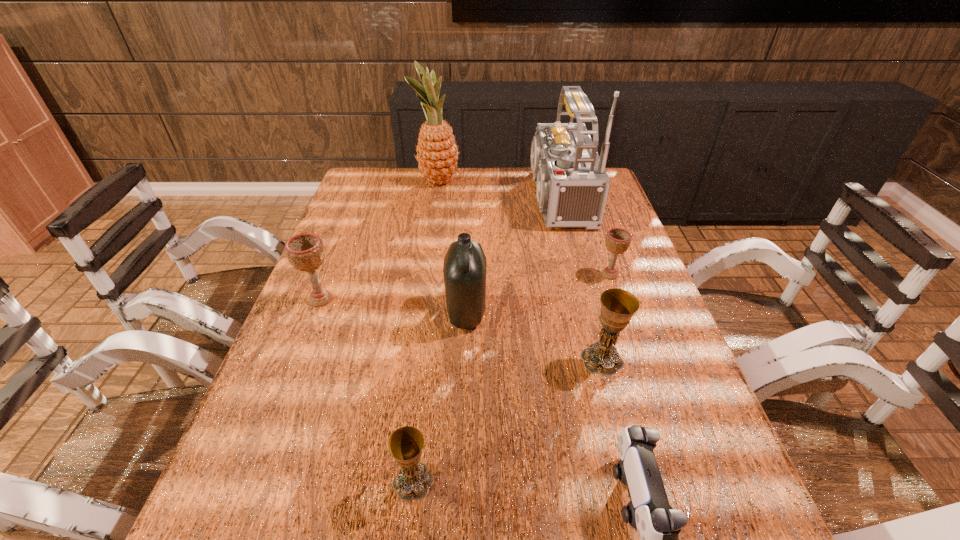
The height and width of the screenshot is (540, 960). In order to click on unoccupied position between the gray radio receiver and the pineapple in this screenshot , I will do `click(494, 189)`.

Find the location of `free space between the nearer beige chalice and the bottle`. free space between the nearer beige chalice and the bottle is located at coordinates (394, 306).

Where is `free space between the smaller gold chalice and the nearer beige chalice`? free space between the smaller gold chalice and the nearer beige chalice is located at coordinates (367, 390).

What are the coordinates of `free space between the farther beige chalice and the nearer gold chalice` in the screenshot? It's located at (512, 378).

Find the location of a particular element. This screenshot has width=960, height=540. free spot between the smaller beige chalice and the sixth shortest object is located at coordinates (538, 293).

Identify which object is the nearest to the radio receiver. Please provide its 2D coordinates. Your answer should be formatted as a tuple, i.e. [(x, y)], where the tuple contains the x and y coordinates of a point satisfying the conditions above.

[(617, 240)]

Choose which object is the fourth nearest neighbor to the farthest chalice. Please provide its 2D coordinates. Your answer should be formatted as a tuple, i.e. [(x, y)], where the tuple contains the x and y coordinates of a point satisfying the conditions above.

[(658, 525)]

You are a GUI agent. You are given a task and a screenshot of the screen. Output one action in this format:
    pyautogui.click(x=<x>, y=<y>)
    Task: Click on the second closest chalice relative to the leftmost chalice
    Image resolution: width=960 pixels, height=540 pixels.
    Given the screenshot: What is the action you would take?
    pyautogui.click(x=618, y=306)

Choose which chalice is the second nearest neighbor to the bottle. Please provide its 2D coordinates. Your answer should be formatted as a tuple, i.e. [(x, y)], where the tuple contains the x and y coordinates of a point satisfying the conditions above.

[(305, 252)]